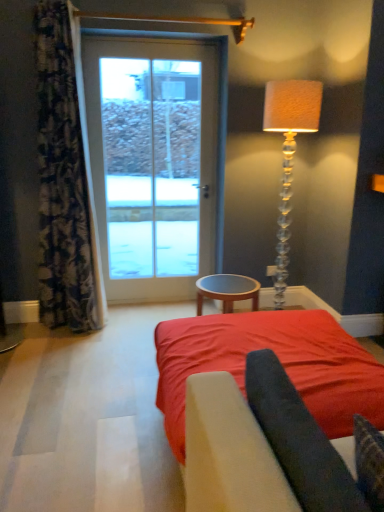
The width and height of the screenshot is (384, 512). In order to click on white glass door at center in this screenshot , I will do `click(154, 169)`.

The image size is (384, 512). What do you see at coordinates (289, 154) in the screenshot?
I see `translucent glass floor lamp at right` at bounding box center [289, 154].

Where is `white glass door at center`? The image size is (384, 512). white glass door at center is located at coordinates (154, 169).

Is brown wooden table at center facing away from translucent glass floor lamp at right?

No, translucent glass floor lamp at right is not at the back of brown wooden table at center.

How distant is brown wooden table at center from translucent glass floor lamp at right?

They are 32.94 inches apart.

Consider the image. Is the position of brown wooden table at center more distant than that of translucent glass floor lamp at right?

No, the depth of brown wooden table at center is less than that of translucent glass floor lamp at right.

Is brown wooden table at center bigger or smaller than translucent glass floor lamp at right?

Considering their sizes, brown wooden table at center takes up less space than translucent glass floor lamp at right.

Are floral fabric curtain at left and translucent glass floor lamp at right located far from each other?

Yes.

Is floral fabric curtain at left bigger or smaller than translucent glass floor lamp at right?

Clearly, floral fabric curtain at left is larger in size than translucent glass floor lamp at right.

Between point (55, 268) and point (308, 93), which one is positioned in front?

Positioned in front is point (308, 93).

Measure the distance between floral fabric curtain at left and translucent glass floor lamp at right.

floral fabric curtain at left is 5.31 feet from translucent glass floor lamp at right.

Is white glass door at center to the right of translucent glass floor lamp at right from the viewer's perspective?

In fact, white glass door at center is to the left of translucent glass floor lamp at right.

In the image, is white glass door at center positioned in front of or behind translucent glass floor lamp at right?

white glass door at center is behind translucent glass floor lamp at right.

Locate an element on the screen. lamp that appears below the white glass door at center (from the image's perspective) is located at coordinates (289, 154).

From a real-world perspective, relative to translucent glass floor lamp at right, is white glass door at center vertically above or below?

white glass door at center is situated higher than translucent glass floor lamp at right in the real world.

Is white glass door at center situated inside brown wooden table at center or outside?

white glass door at center cannot be found inside brown wooden table at center.

Are white glass door at center and brown wooden table at center located far from each other?

Yes, white glass door at center is far from brown wooden table at center.

Locate an element on the screen. The height and width of the screenshot is (512, 384). table located underneath the white glass door at center (from a real-world perspective) is located at coordinates (227, 290).

Is point (144, 103) behind point (229, 291)?

Yes, it is.

Is red fabric bed at center beside floral fabric curtain at left?

No, red fabric bed at center is not making contact with floral fabric curtain at left.

From the picture: Is red fabric bed at center taller than floral fabric curtain at left?

In fact, red fabric bed at center may be shorter than floral fabric curtain at left.

Does red fabric bed at center come behind floral fabric curtain at left?

No, it is in front of floral fabric curtain at left.

Based on their sizes in the image, would you say red fabric bed at center is bigger or smaller than floral fabric curtain at left?

red fabric bed at center is bigger than floral fabric curtain at left.

Would you say white glass door at center is outside dark fabric at center?

Yes, white glass door at center is outside of dark fabric at center.

From the image's perspective, is white glass door at center located beneath dark fabric at center?

Incorrect, from the image's perspective, white glass door at center is higher than dark fabric at center.

Is point (154, 58) closer to camera compared to point (291, 422)?

No.

Between white glass door at center and dark fabric at center, which one has less height?

dark fabric at center.

Locate an element on the screen. curtain above the dark fabric at center (from a real-world perspective) is located at coordinates (64, 183).

Considering the positions of points (46, 186) and (272, 446), is point (46, 186) farther from camera compared to point (272, 446)?

Yes, point (46, 186) is behind point (272, 446).

Between floral fabric curtain at left and dark fabric at center, which one has smaller size?

Smaller between the two is dark fabric at center.

From a real-world perspective, who is located higher, floral fabric curtain at left or dark fabric at center?

floral fabric curtain at left.

This screenshot has width=384, height=512. I want to click on table below the translucent glass floor lamp at right (from the image's perspective), so click(227, 290).

I want to click on curtain above the translucent glass floor lamp at right (from the image's perspective), so click(64, 183).

Estimate the real-world distances between objects in this image. Which object is further from white glass door at center, brown wooden table at center or dark fabric at center?

dark fabric at center lies further to white glass door at center than the other object.

Based on their spatial positions, is floral fabric curtain at left or red fabric bed at center further from white glass door at center?

Based on the image, red fabric bed at center appears to be further to white glass door at center.

Based on their spatial positions, is white glass door at center or translucent glass floor lamp at right closer to floral fabric curtain at left?

Among the two, white glass door at center is located nearer to floral fabric curtain at left.

Considering their positions, is dark fabric at center positioned closer to red fabric bed at center than translucent glass floor lamp at right?

dark fabric at center lies closer to red fabric bed at center than the other object.

Based on their spatial positions, is dark fabric at center or brown wooden table at center further from red fabric bed at center?

Among the two, dark fabric at center is located further to red fabric bed at center.

Considering their positions, is brown wooden table at center positioned closer to white glass door at center than red fabric bed at center?

brown wooden table at center.

Estimate the real-world distances between objects in this image. Which object is closer to dark fabric at center, floral fabric curtain at left or translucent glass floor lamp at right?

floral fabric curtain at left is positioned closer to the anchor dark fabric at center.

Estimate the real-world distances between objects in this image. Which object is closer to floral fabric curtain at left, translucent glass floor lamp at right or red fabric bed at center?

Among the two, red fabric bed at center is located nearer to floral fabric curtain at left.

Identify the location of table between dark fabric at center and white glass door at center in the front-back direction. Image resolution: width=384 pixels, height=512 pixels. (227, 290).

Where is `curtain positioned between red fabric bed at center and white glass door at center from near to far`? The image size is (384, 512). curtain positioned between red fabric bed at center and white glass door at center from near to far is located at coordinates (64, 183).

Locate an element on the screen. The image size is (384, 512). table positioned between dark fabric at center and translucent glass floor lamp at right from near to far is located at coordinates (227, 290).

Image resolution: width=384 pixels, height=512 pixels. In order to click on table between white glass door at center and translucent glass floor lamp at right in this screenshot , I will do `click(227, 290)`.